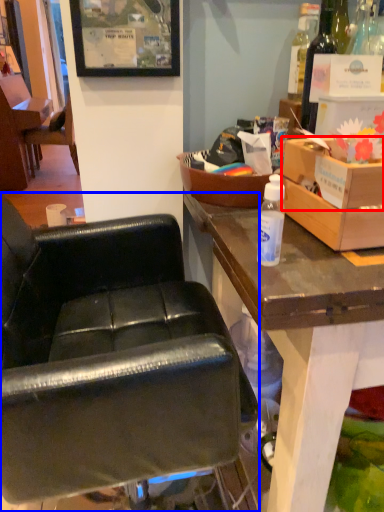
Question: Among these objects, which one is farthest to the camera, box (highlighted by a red box) or chair (highlighted by a blue box)?

Choices:
 (A) box
 (B) chair

Answer: (A)